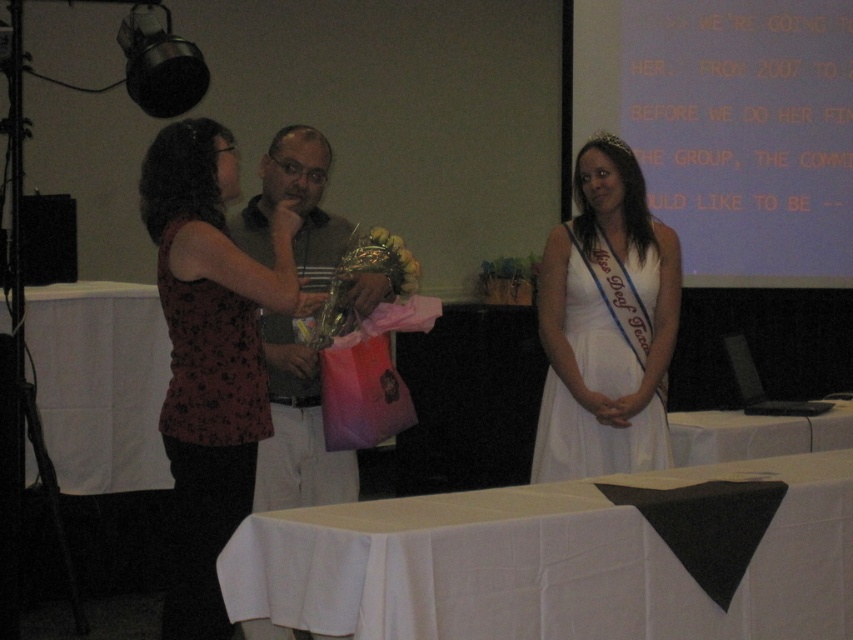
Question: Among these points, which one is farthest from the camera?

Choices:
 (A) (833, 140)
 (B) (299, 166)

Answer: (A)

Question: Which point is closer to the camera?

Choices:
 (A) white satin dress at center
 (B) matte plastic bag at center
 (C) white cloth at lower center
 (D) gold metallic tiara at upper center

Answer: (C)

Question: Is white cloth at lower center wider than matte plastic bag at center?

Choices:
 (A) no
 (B) yes

Answer: (B)

Question: Does white cloth at lower center have a greater width compared to matte plastic bag at center?

Choices:
 (A) no
 (B) yes

Answer: (B)

Question: Does white satin dress at center appear under matte plastic bag at center?

Choices:
 (A) yes
 (B) no

Answer: (A)

Question: Which is nearer to the matte plastic bag at center?

Choices:
 (A) white satin dress at center
 (B) white cloth at lower center

Answer: (A)